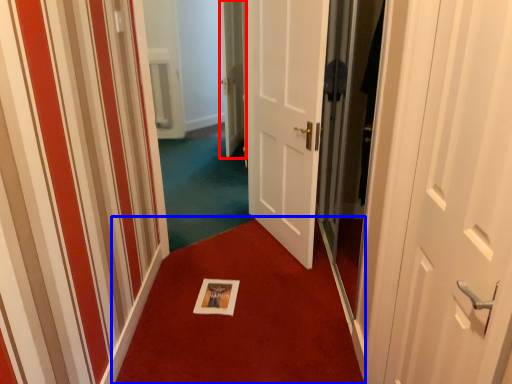
Question: Which point is closer to the camera, door (highlighted by a red box) or doormat (highlighted by a blue box)?

Choices:
 (A) door
 (B) doormat

Answer: (B)